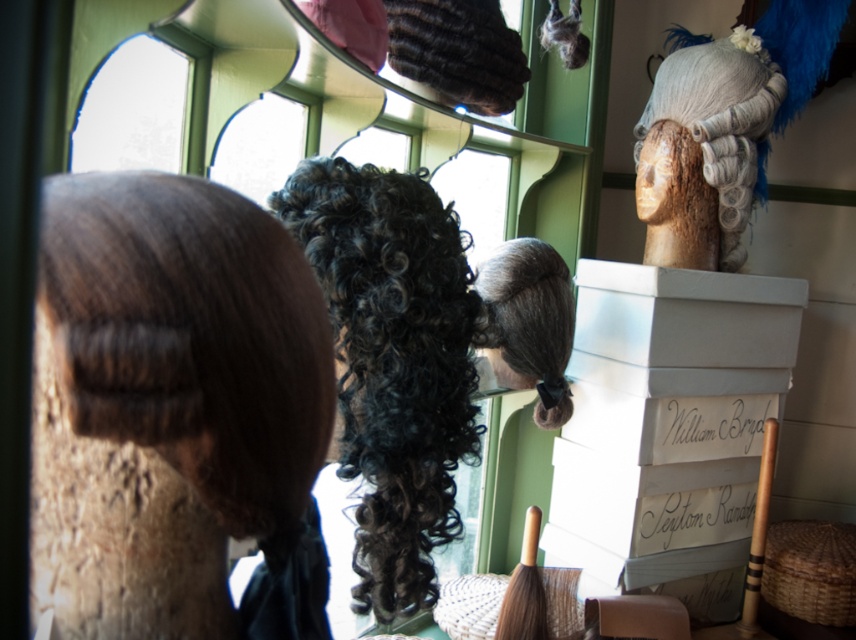
Question: Among these points, which one is farthest from the camera?

Choices:
 (A) (140, 467)
 (B) (553, 360)
 (C) (746, 202)
 (D) (388, 278)

Answer: (C)

Question: From the image, what is the correct spatial relationship of dark brown hair at center in relation to dark brown curly wig at center?

Choices:
 (A) left
 (B) right

Answer: (A)

Question: Among these objects, which one is nearest to the camera?

Choices:
 (A) dark brown hair at center
 (B) dark brown curly wig at center

Answer: (A)

Question: Can you confirm if dark brown hair at center is positioned above white fabric wig at upper right?

Choices:
 (A) no
 (B) yes

Answer: (A)

Question: Among these objects, which one is farthest from the camera?

Choices:
 (A) dark brown hair at center
 (B) dark brown curly wig at center

Answer: (B)

Question: Considering the relative positions of curly dark brown wig at center and white fabric wig at upper right in the image provided, where is curly dark brown wig at center located with respect to white fabric wig at upper right?

Choices:
 (A) left
 (B) right

Answer: (A)